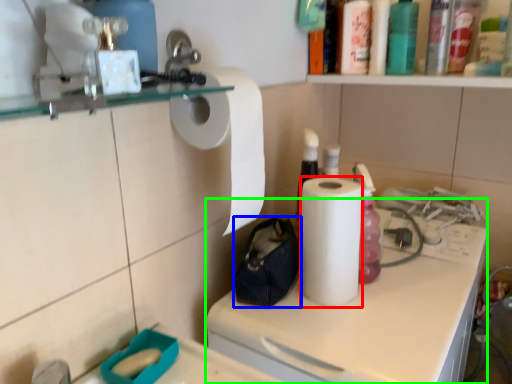
Question: Based on their relative distances, which object is farther from paper towel (highlighted by a red box)? Choose from pouch (highlighted by a blue box) and counter (highlighted by a green box).

Choices:
 (A) pouch
 (B) counter

Answer: (B)